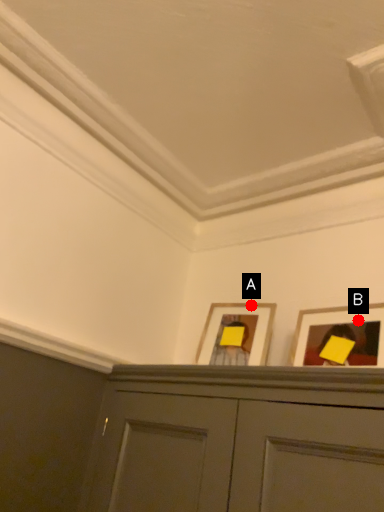
Question: Two points are circled on the image, labeled by A and B beside each circle. Among these points, which one is nearest to the camera?

Choices:
 (A) A is closer
 (B) B is closer

Answer: (B)